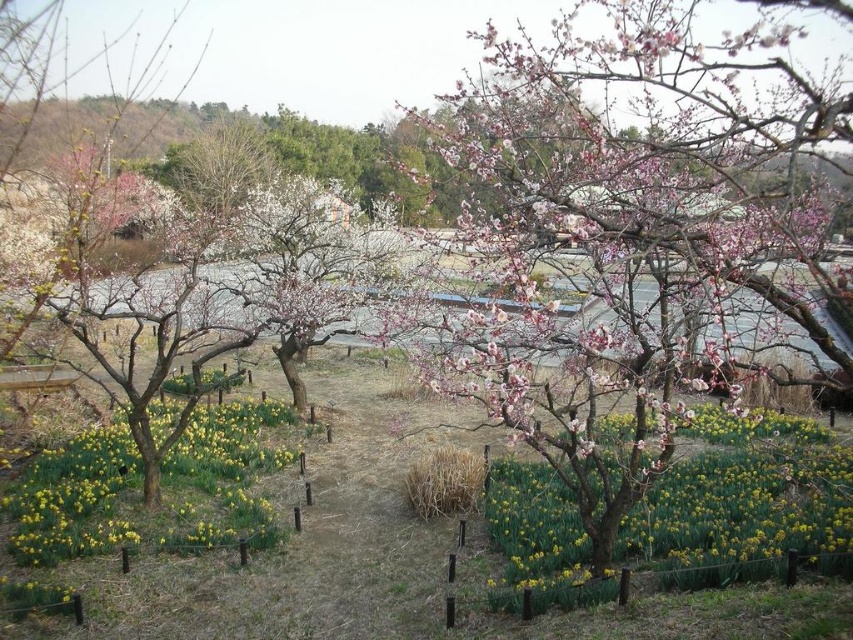
You are a gardener who wants to plant a new flower between the pink matte flower at center and the yellow matte daffodil at center. Since both flowers are at the center, where exactly should you place the new flower?

The pink matte flower at center is positioned over the yellow matte daffodil at center, so the new flower should be placed between them by positioning it below the pink matte flower at center and above the yellow matte daffodil at center.

You are standing in the park and see the pink bloom tree at center and the yellow matte daffodil at center. Which one is nearer to you?

The pink bloom tree at center is closer to the viewer than the yellow matte daffodil at center.

You are standing at the point marked as point (x=621, y=509). You want to walk straight ahead. How far will you have to walk before you reach the edge of the field of yellow flowers?

The distance between the point (x=621, y=509) and the edge of the field of yellow flowers is 3.46 meters, so you will have to walk 3.46 meters before reaching it.